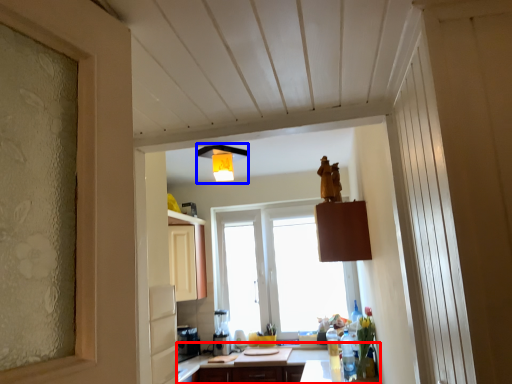
Question: Which of the following is the closest to the observer, countertop (highlighted by a red box) or light fixture (highlighted by a blue box)?

Choices:
 (A) countertop
 (B) light fixture

Answer: (B)